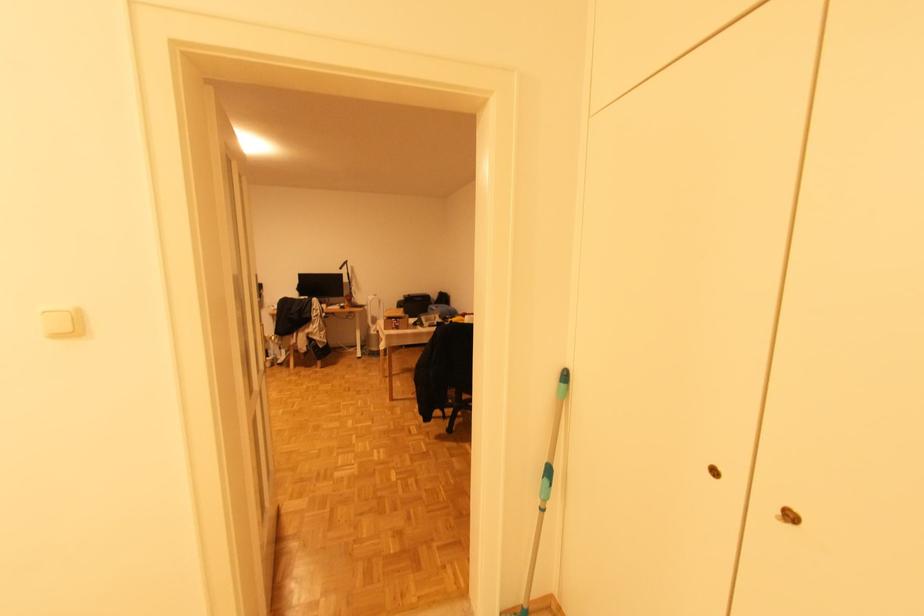
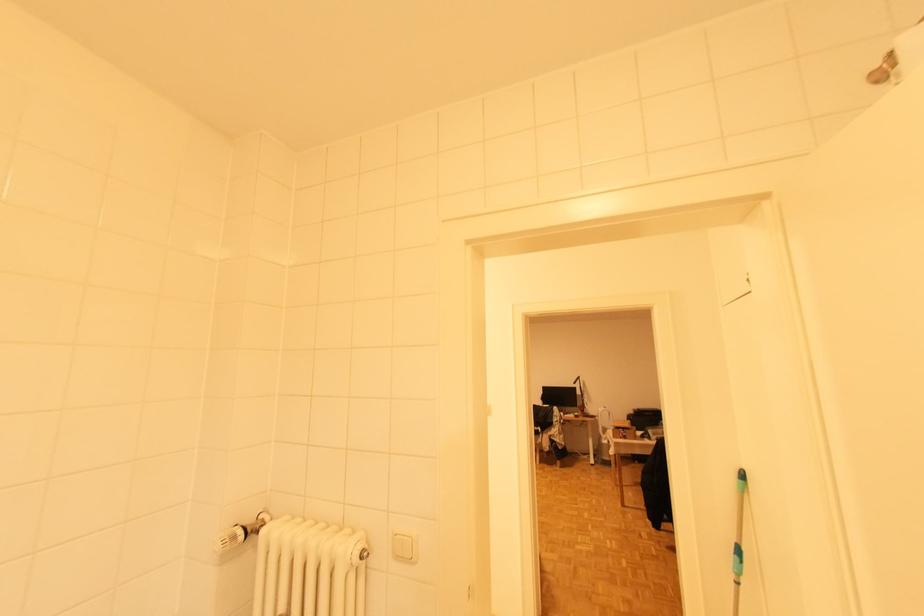
In the second image, find the point that corresponds to [552,472] in the first image.

(742, 552)